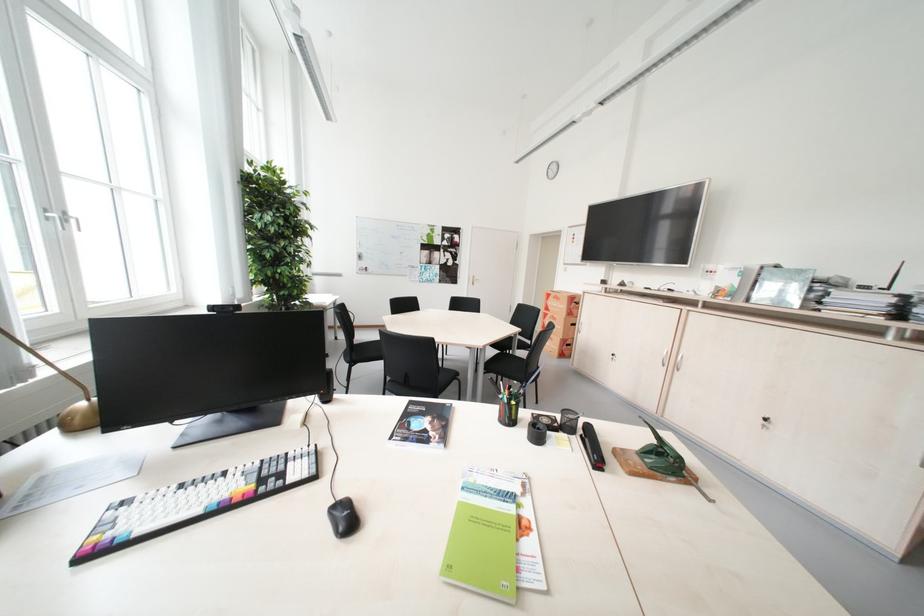
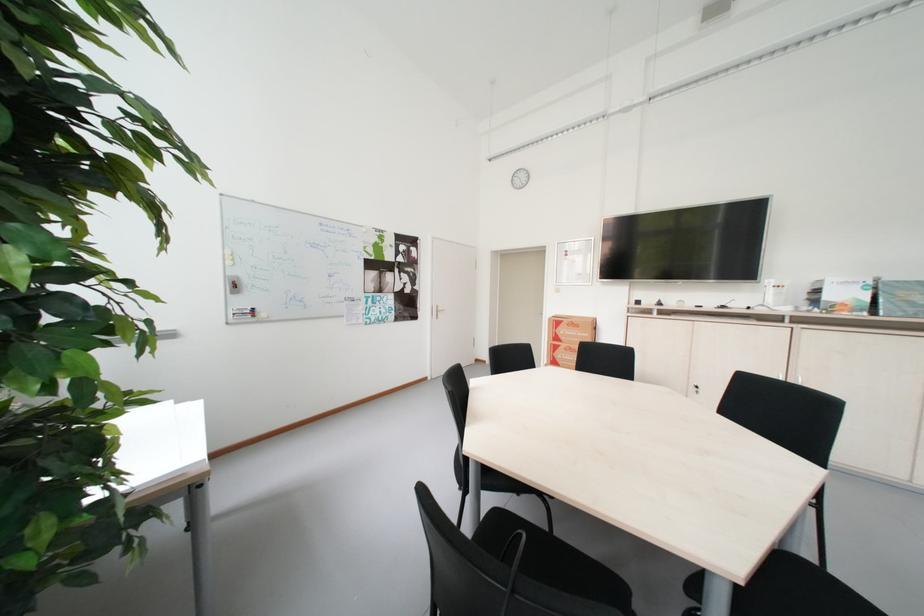
Locate, in the second image, the point that corresponds to the point at 473,275 in the first image.

(434, 305)